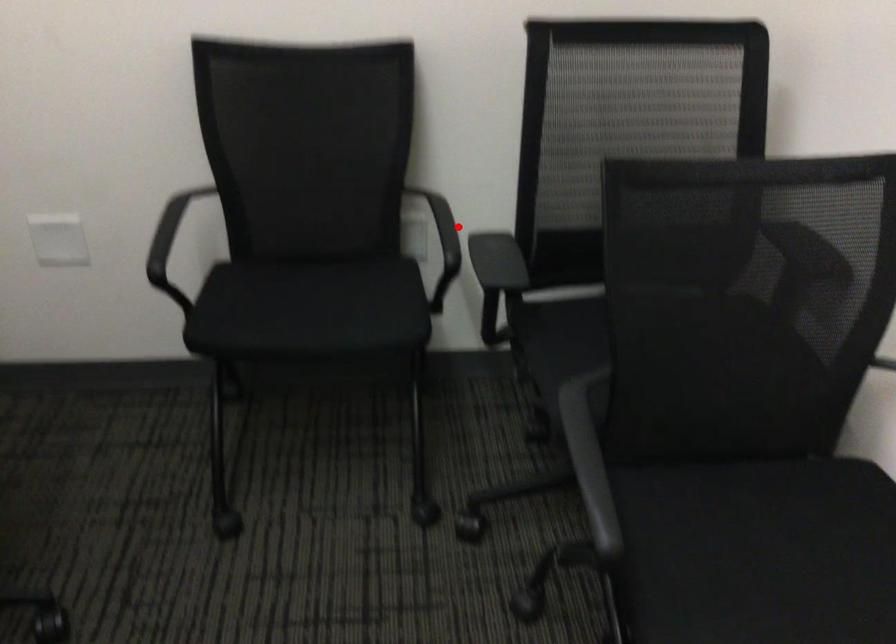
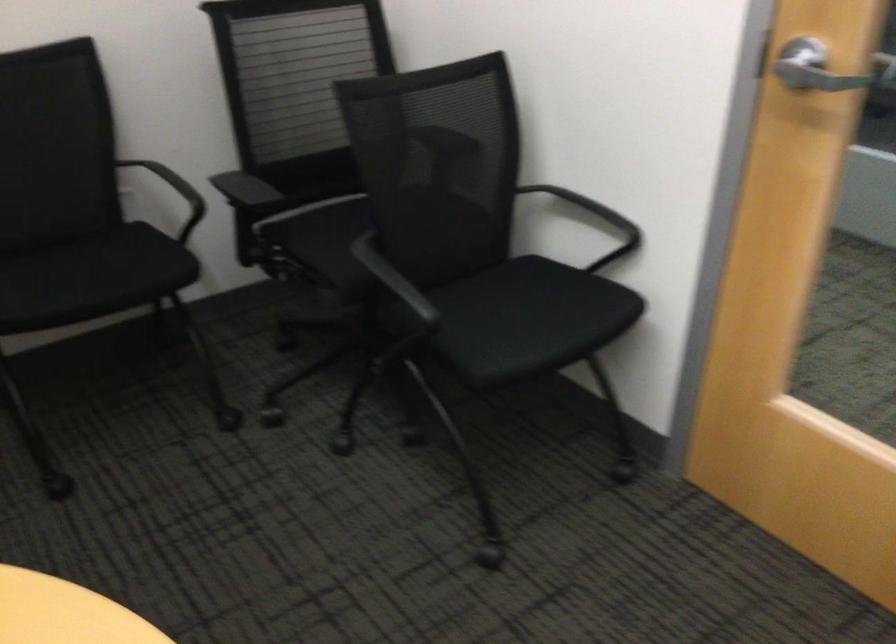
In the second image, find the point that corresponds to the highlighted location in the first image.

(174, 192)